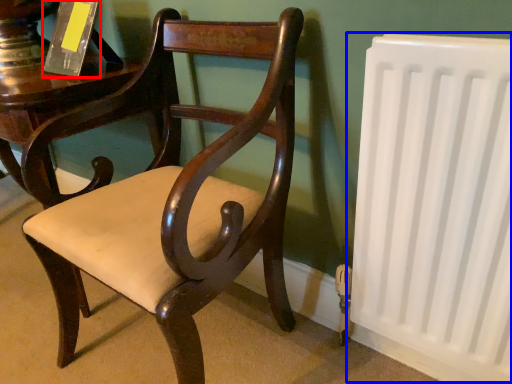
Question: Among these objects, which one is farthest to the camera, paperback book (highlighted by a red box) or radiator (highlighted by a blue box)?

Choices:
 (A) paperback book
 (B) radiator

Answer: (A)